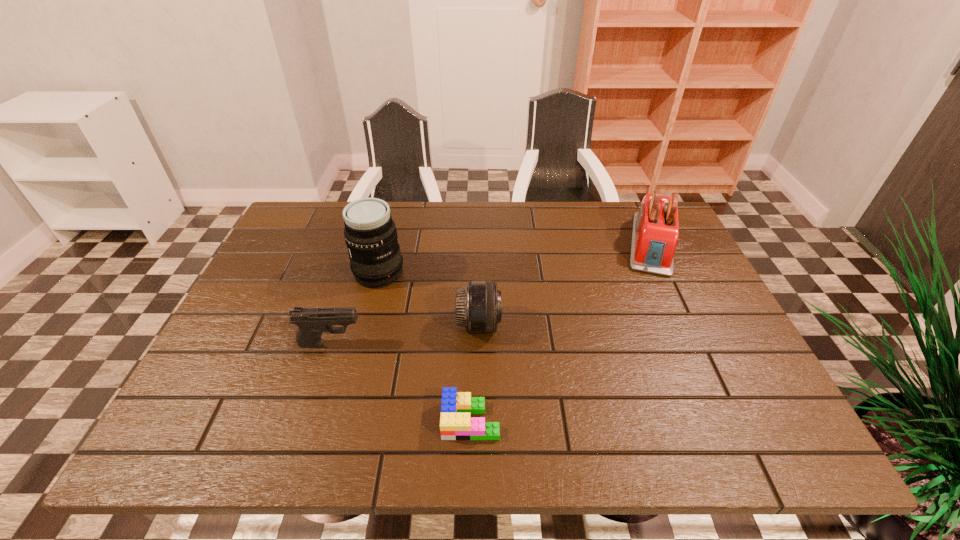
I want to click on blank space at the left edge, so click(263, 282).

In the image, there is a desktop. Where is `vacant region at the right edge`? vacant region at the right edge is located at coordinates (686, 317).

Locate an element on the screen. This screenshot has width=960, height=540. free space at the far left corner of the desktop is located at coordinates (292, 229).

The image size is (960, 540). In the image, there is a desktop. Find the location of `free space at the near right corner`. free space at the near right corner is located at coordinates (780, 448).

Where is `vacant space that's between the shortest object and the nearer telephoto lens`? vacant space that's between the shortest object and the nearer telephoto lens is located at coordinates (475, 372).

Image resolution: width=960 pixels, height=540 pixels. I want to click on vacant area between the shortest object and the nearer telephoto lens, so click(475, 372).

Find the location of a particular element. This screenshot has height=540, width=960. free space between the shorter telephoto lens and the nearest object is located at coordinates (475, 372).

Image resolution: width=960 pixels, height=540 pixels. What are the coordinates of `free area in between the second tallest object and the left telephoto lens` in the screenshot? It's located at (516, 258).

Find the location of a particular element. This screenshot has width=960, height=540. empty space between the toaster and the left telephoto lens is located at coordinates (516, 258).

In order to click on free space that is in between the pistol and the shortest object in this screenshot , I will do `click(400, 381)`.